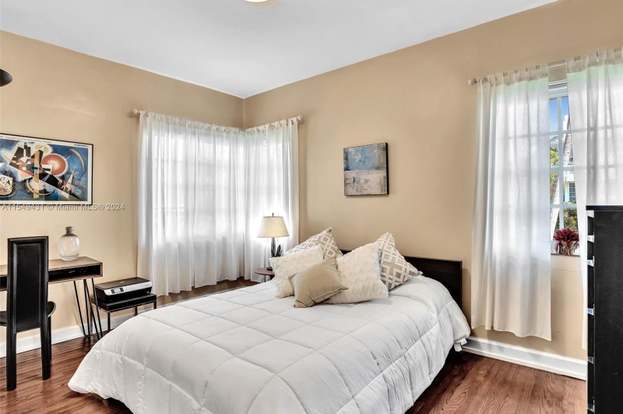
Where is `black pieces of furniture`? black pieces of furniture is located at coordinates (26, 309), (52, 275), (121, 298), (443, 275), (616, 330).